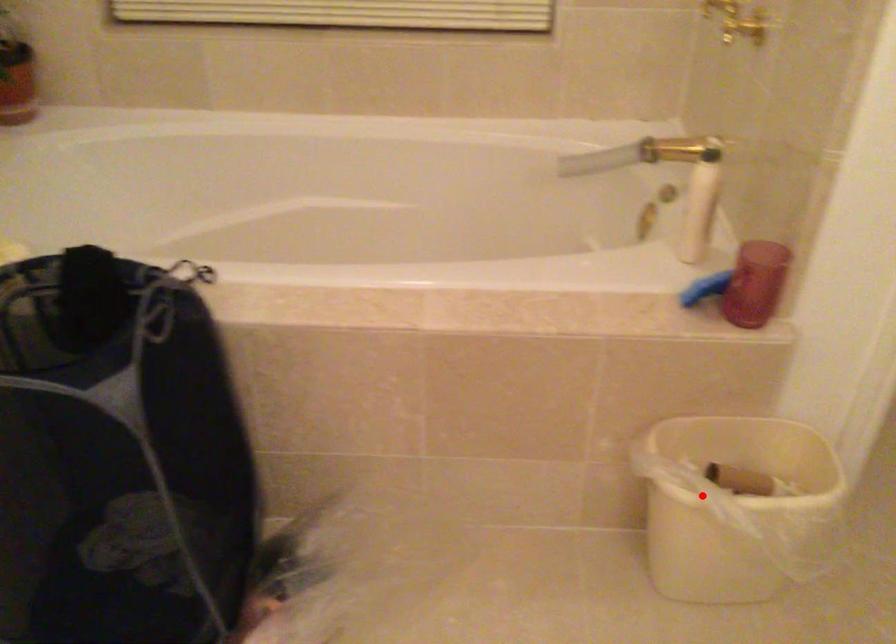
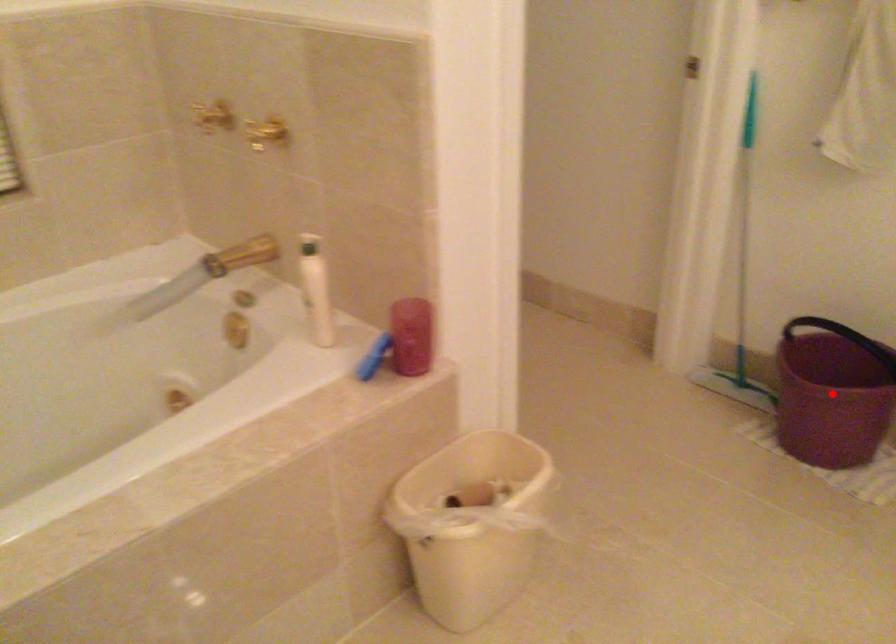
I am providing you with two images of the same scene from different viewpoints. A red point is marked on the first image and another point is marked on the second image. Is the marked point in image1 the same physical position as the marked point in image2?

No